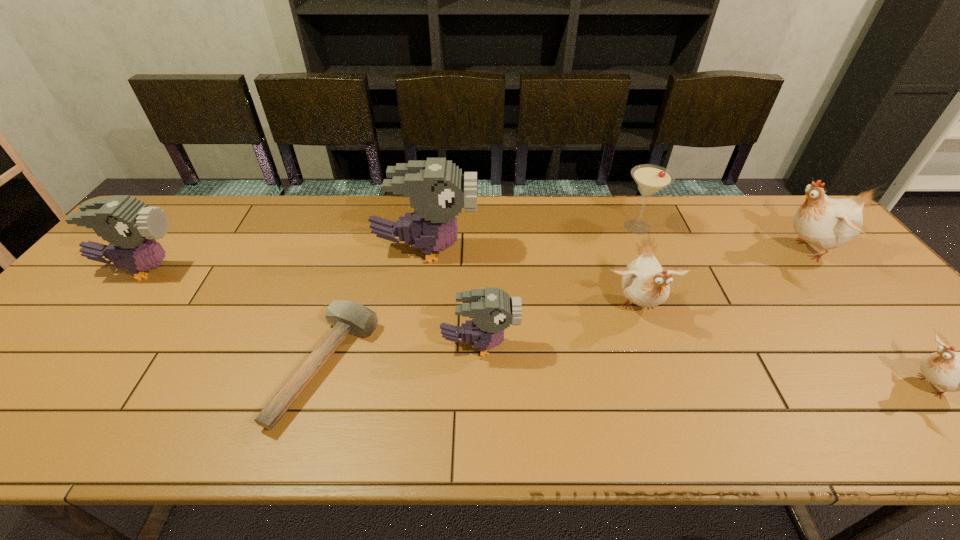
At what (x,y) coordinates should I click in order to perform the action: click on free location located at the beak of the biggest gray bird. Please return your answer as a coordinate pair (x, y). Looking at the image, I should click on (569, 251).

Where is `vacant position located 0.180m at the beak of the biggest white bird`? vacant position located 0.180m at the beak of the biggest white bird is located at coordinates (710, 249).

The width and height of the screenshot is (960, 540). Find the location of `vacant region located 0.210m at the beak of the biggest white bird`. vacant region located 0.210m at the beak of the biggest white bird is located at coordinates coord(700,249).

Find the location of a particular element. free location located 0.230m at the beak of the biggest white bird is located at coordinates (693, 249).

Identify the location of vacant region located 0.330m at the beak of the leftmost object. The height and width of the screenshot is (540, 960). (304, 269).

Locate an element on the screen. This screenshot has width=960, height=540. vacant space situated on the right of the martini is located at coordinates (776, 227).

Find the location of a particular element. This screenshot has width=960, height=540. vacant space located 0.210m at the beak of the second smallest white bird is located at coordinates (675, 410).

This screenshot has width=960, height=540. I want to click on free space located at the beak of the smallest gray bird, so click(x=682, y=346).

Image resolution: width=960 pixels, height=540 pixels. What are the coordinates of `free space located on the right of the shortest object` in the screenshot? It's located at (511, 366).

The height and width of the screenshot is (540, 960). I want to click on martini present at the far edge, so click(650, 179).